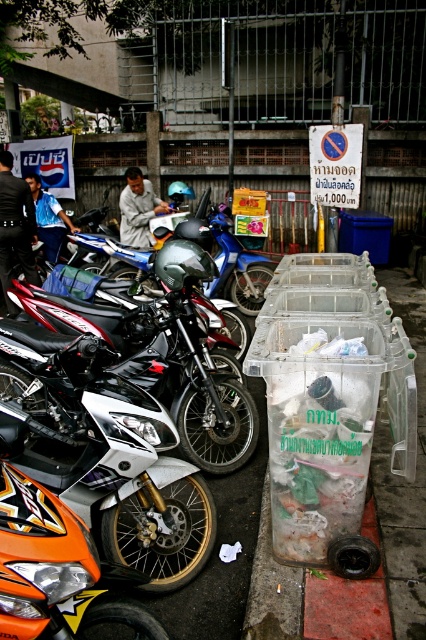
Does dark blue shirt at left have a smaller size compared to blue shirt at center?

Actually, dark blue shirt at left might be larger than blue shirt at center.

Does dark blue shirt at left have a greater height compared to blue shirt at center?

Yes.

Describe the element at coordinates (14, 227) in the screenshot. I see `dark blue shirt at left` at that location.

The image size is (426, 640). I want to click on dark blue shirt at left, so click(x=14, y=227).

Is point (132, 202) more distant than point (37, 216)?

No, it is in front of (37, 216).

Does light brown fabric shirt at center appear over blue shirt at center?

Yes, light brown fabric shirt at center is above blue shirt at center.

Between point (129, 198) and point (31, 177), which one is positioned behind?

The point (31, 177) is more distant.

This screenshot has width=426, height=640. What are the coordinates of `light brown fabric shirt at center` in the screenshot? It's located at (138, 209).

Between shiny black motorcycle at center and blue shirt at center, which one has less height?

Standing shorter between the two is blue shirt at center.

Is shiny black motorcycle at center positioned at the back of blue shirt at center?

No.

Identify the location of shiny black motorcycle at center. Image resolution: width=426 pixels, height=640 pixels. (224, 257).